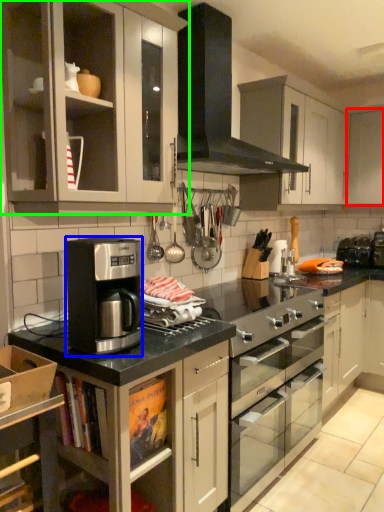
Question: Considering the real-world distances, which object is closest to cabinetry (highlighted by a red box)? kitchen appliance (highlighted by a blue box) or cabinetry (highlighted by a green box).

Choices:
 (A) kitchen appliance
 (B) cabinetry

Answer: (B)